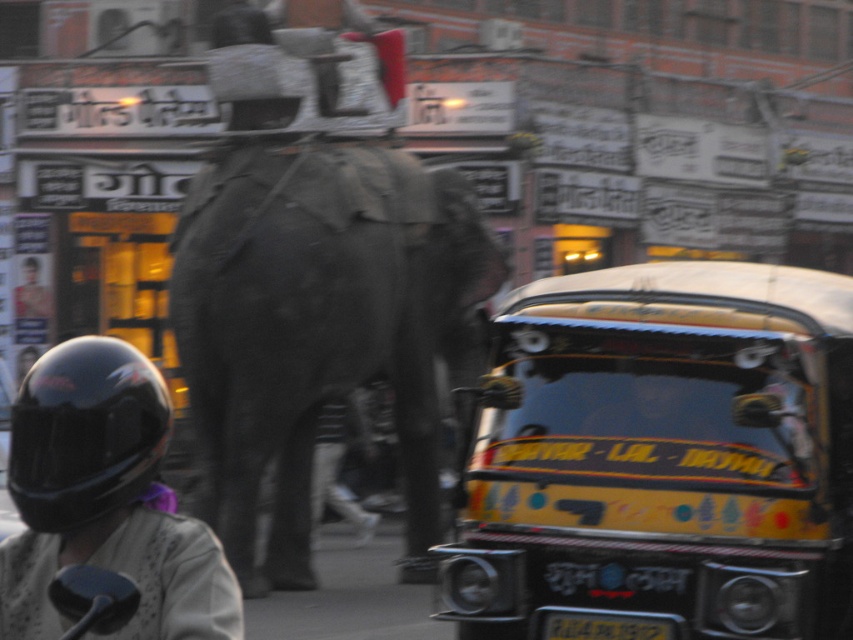
Which is more to the right, yellow painted auto-rickshaw at center or black plastic license plate at center?

Positioned to the right is yellow painted auto-rickshaw at center.

Who is shorter, yellow painted auto-rickshaw at center or black plastic license plate at center?

Standing shorter between the two is black plastic license plate at center.

This screenshot has height=640, width=853. Identify the location of yellow painted auto-rickshaw at center. (662, 454).

Looking at this image, is black matte helmet at lower left positioned behind black plastic license plate at center?

No.

Between point (165, 621) and point (576, 612), which one is positioned behind?

Positioned behind is point (576, 612).

What are the coordinates of `black matte helmet at lower left` in the screenshot? It's located at (103, 500).

Which is in front, point (717, 332) or point (103, 417)?

Point (103, 417) is in front.

Can you confirm if yellow painted auto-rickshaw at center is wider than black matte helmet at lower left?

Correct, the width of yellow painted auto-rickshaw at center exceeds that of black matte helmet at lower left.

Measure the distance between yellow painted auto-rickshaw at center and camera.

A distance of 27.51 feet exists between yellow painted auto-rickshaw at center and camera.

Where is `yellow painted auto-rickshaw at center`? Image resolution: width=853 pixels, height=640 pixels. yellow painted auto-rickshaw at center is located at coordinates [662, 454].